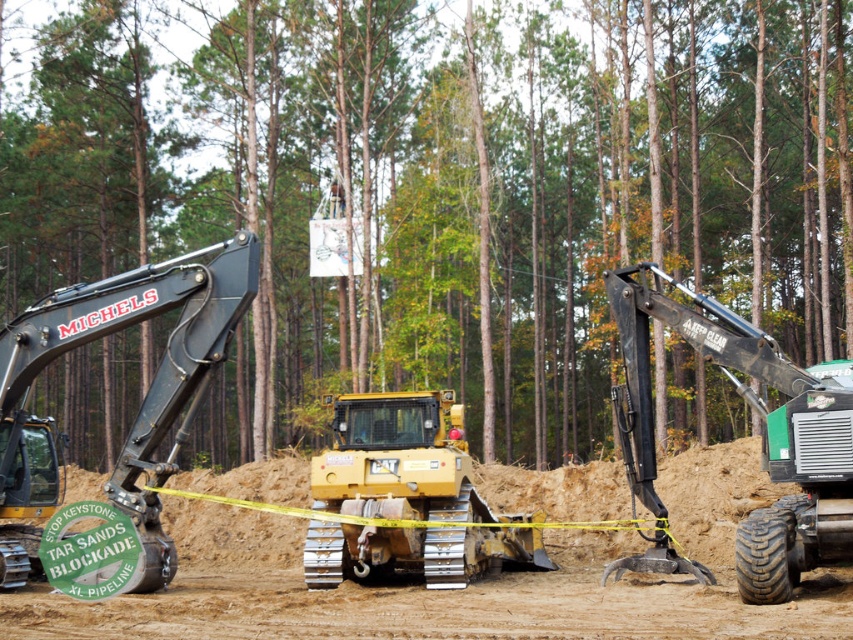
Question: Is brown sandy dirt at center thinner than matte black excavator at left?

Choices:
 (A) no
 (B) yes

Answer: (A)

Question: Which object is the closest to the yellow rubber tracked vehicle at center?

Choices:
 (A) yellow rubber tracked tractor at center
 (B) green rubber tractor at right
 (C) brown sandy dirt at center

Answer: (C)

Question: Which object appears closest to the camera in this image?

Choices:
 (A) brown sandy dirt at center
 (B) green leafy tree at center
 (C) yellow rubber tracked tractor at center
 (D) matte black excavator at left

Answer: (A)

Question: Does green rubber tractor at right appear under matte black excavator at left?

Choices:
 (A) no
 (B) yes

Answer: (B)

Question: From the image, what is the correct spatial relationship of yellow rubber tracked vehicle at center in relation to green rubber tractor at right?

Choices:
 (A) above
 (B) below

Answer: (B)

Question: Which object is closer to the camera taking this photo?

Choices:
 (A) green rubber tractor at right
 (B) brown sandy dirt at center

Answer: (B)